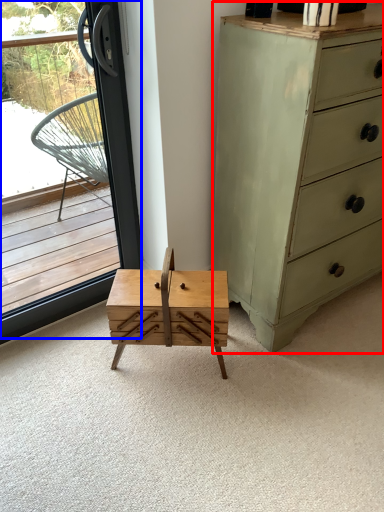
Question: Among these objects, which one is farthest to the camera, chest of drawers (highlighted by a red box) or window (highlighted by a blue box)?

Choices:
 (A) chest of drawers
 (B) window

Answer: (B)